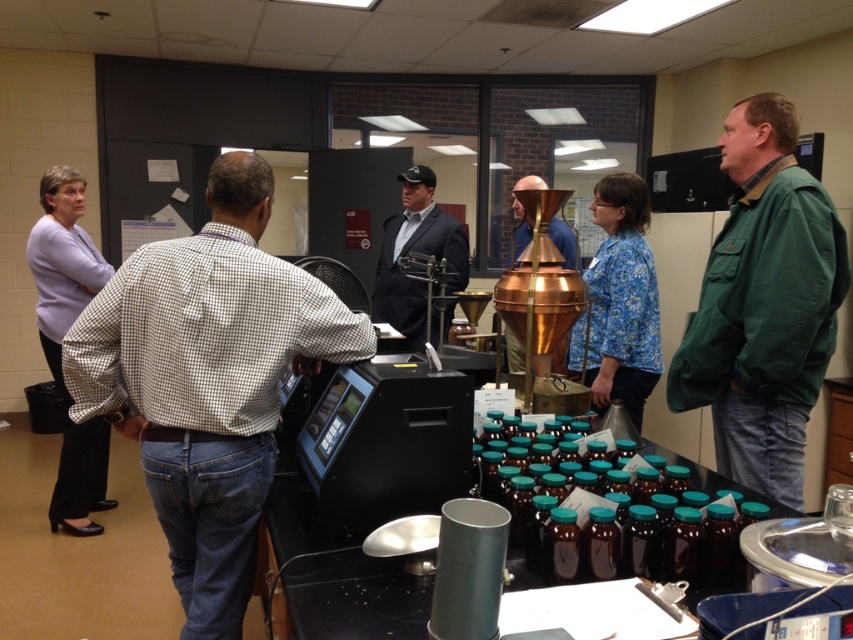
Which is behind, point (396, 241) or point (527, 216)?

The point (396, 241) is behind.

Is black suit at center closer to the viewer compared to copper metallic brewing apparatus at center?

Yes, black suit at center is in front of copper metallic brewing apparatus at center.

Who is more forward, (381, 248) or (558, 364)?

Point (558, 364) is in front.

Identify the location of black suit at center. This screenshot has height=640, width=853. (419, 252).

Can you confirm if blue floral shirt at center is smaller than light purple fabric shirt at left?

Indeed, blue floral shirt at center has a smaller size compared to light purple fabric shirt at left.

You are a GUI agent. You are given a task and a screenshot of the screen. Output one action in this format:
    pyautogui.click(x=<x>, y=<y>)
    Task: Click on the blue floral shirt at center
    The height and width of the screenshot is (640, 853).
    Given the screenshot: What is the action you would take?
    pyautogui.click(x=619, y=301)

Which is in front, point (643, 396) or point (96, 285)?

Point (643, 396)

Where is `blue floral shirt at center`? blue floral shirt at center is located at coordinates (619, 301).

Is point (78, 326) farther from viewer compared to point (425, 307)?

No, it is not.

Can you confirm if white checkered shirt at center is smaller than black suit at center?

Yes, white checkered shirt at center is smaller than black suit at center.

Describe the element at coordinates (207, 380) in the screenshot. I see `white checkered shirt at center` at that location.

Find the location of a particular element. white checkered shirt at center is located at coordinates (207, 380).